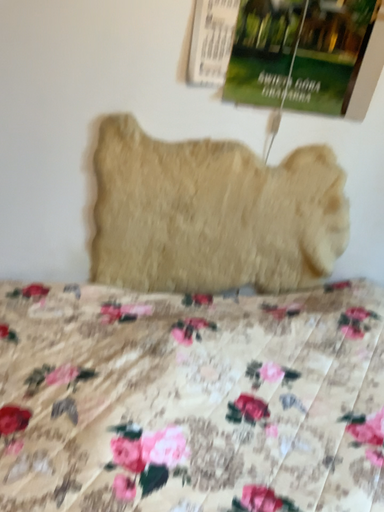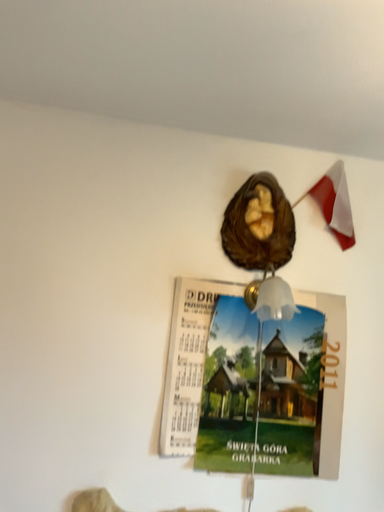
Question: Which way did the camera rotate in the video?

Choices:
 (A) rotated upward
 (B) rotated downward

Answer: (A)